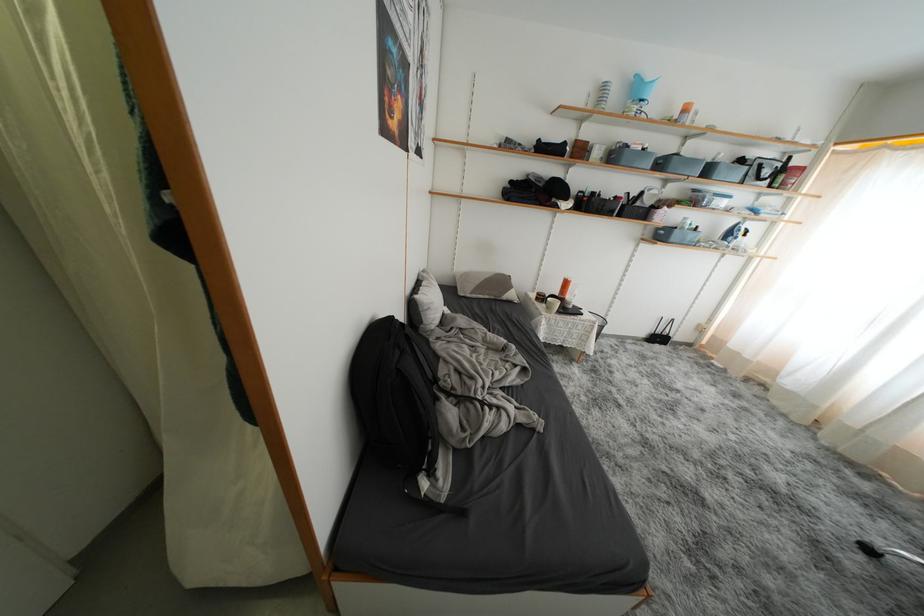
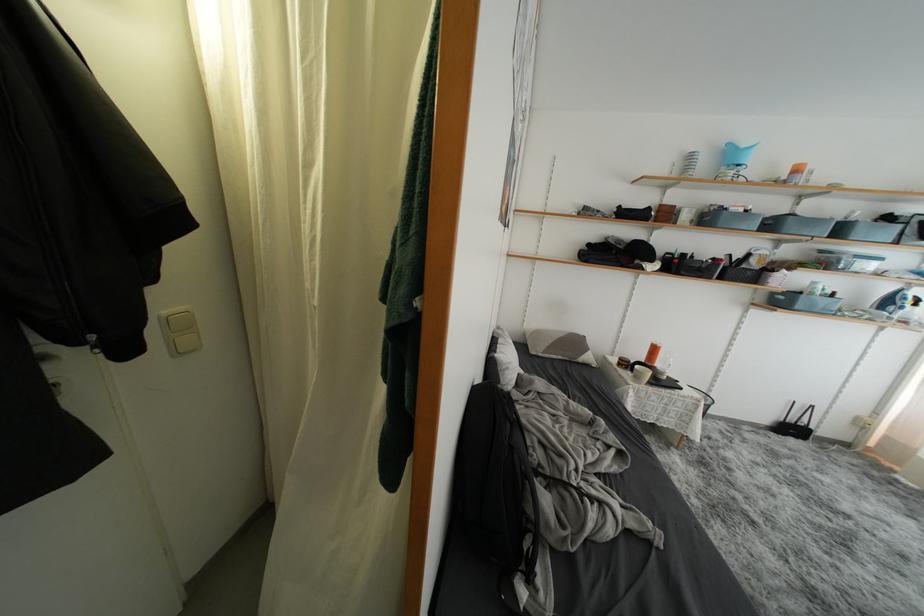
In the second image, find the point that corresponds to pixel 667 168 in the first image.

(777, 229)